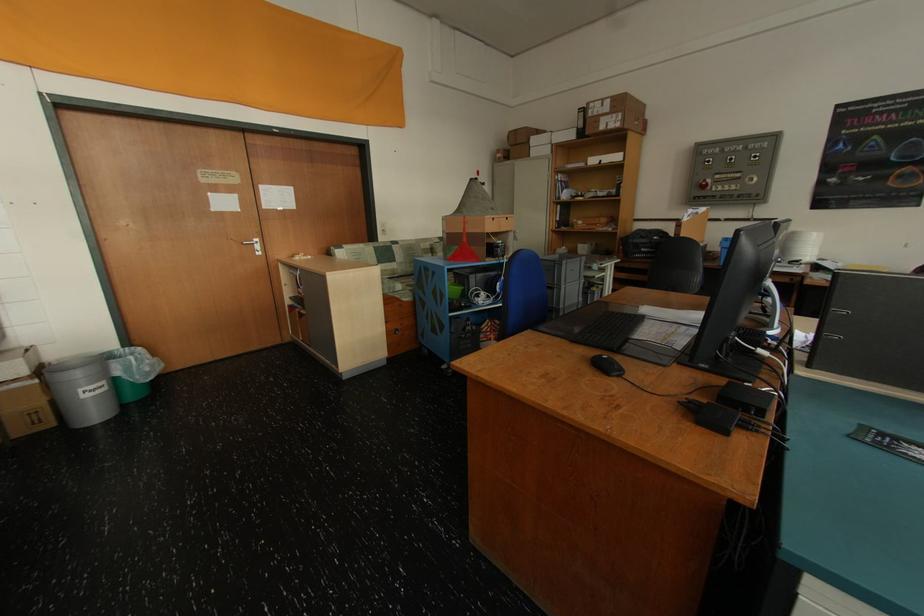
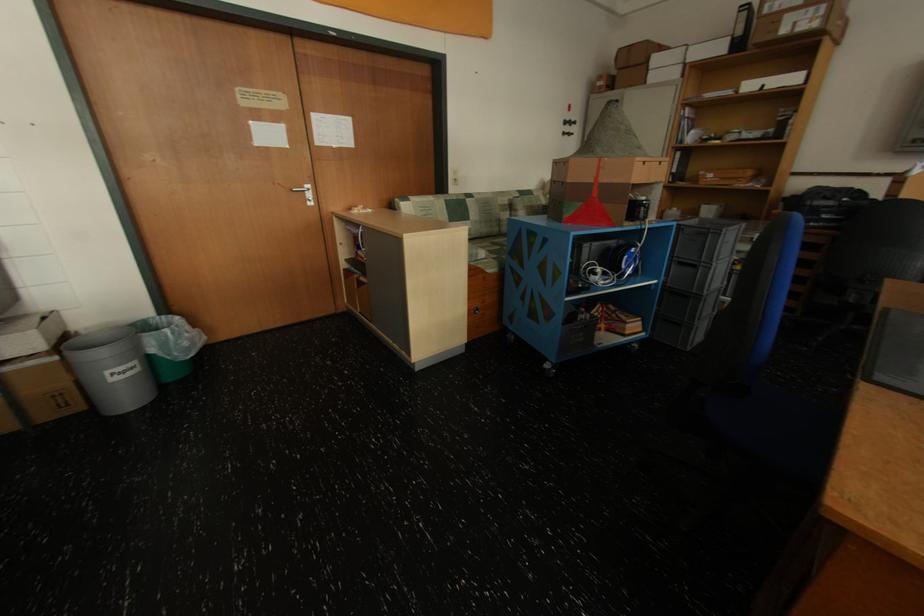
Question: Based on the continuous images, in which direction is the camera rotating? Reply with the corresponding letter.

Choices:
 (A) Left
 (B) Right
 (C) Up
 (D) Down

Answer: (D)